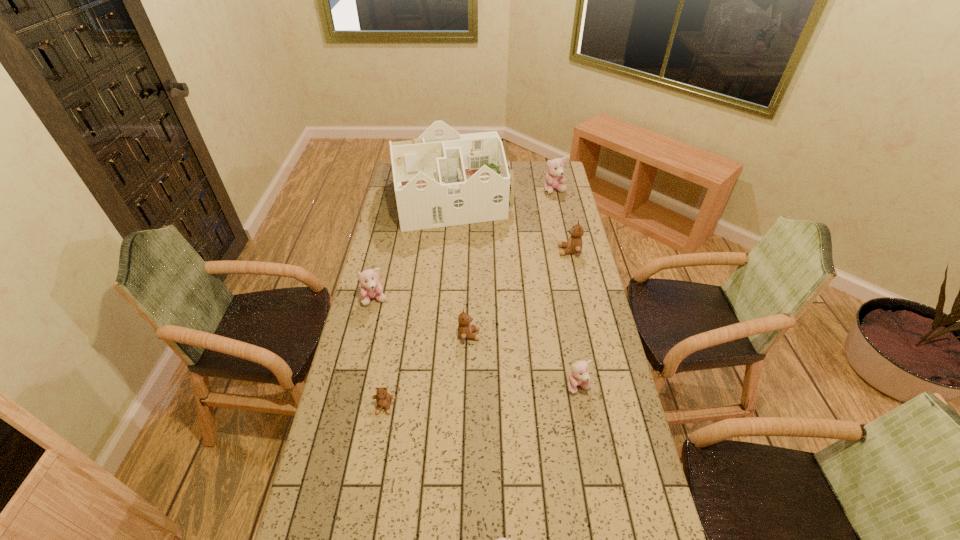
Find the location of `white dollhouse`. white dollhouse is located at coordinates (443, 178).

You are a GUI agent. You are given a task and a screenshot of the screen. Output one action in this format:
    pyautogui.click(x=<x>, y=<y>)
    Task: Click on the dollhouse
    Image resolution: width=960 pixels, height=540 pixels.
    Given the screenshot: What is the action you would take?
    pyautogui.click(x=443, y=178)

You are a GUI agent. You are given a task and a screenshot of the screen. Output one action in this format:
    pyautogui.click(x=<x>, y=<y>)
    Task: Click on the farthest teddy bear
    
    Given the screenshot: What is the action you would take?
    pyautogui.click(x=554, y=177)

I want to click on the biggest pink teddy bear, so click(x=554, y=177).

You are a GUI agent. You are given a task and a screenshot of the screen. Output one action in this format:
    pyautogui.click(x=<x>, y=<y>)
    Task: Click on the leftmost pink teddy bear
    Image resolution: width=960 pixels, height=540 pixels.
    Given the screenshot: What is the action you would take?
    pyautogui.click(x=371, y=288)

Image resolution: width=960 pixels, height=540 pixels. I want to click on the second biggest pink teddy bear, so click(x=371, y=288).

Find the location of `the farthest brown teddy bear`. the farthest brown teddy bear is located at coordinates (574, 245).

The image size is (960, 540). I want to click on the biggest brown teddy bear, so 574,245.

Find the location of `the fourth nearest teddy bear`. the fourth nearest teddy bear is located at coordinates (465, 330).

The image size is (960, 540). Find the location of `the second biggest brown teddy bear`. the second biggest brown teddy bear is located at coordinates (465, 330).